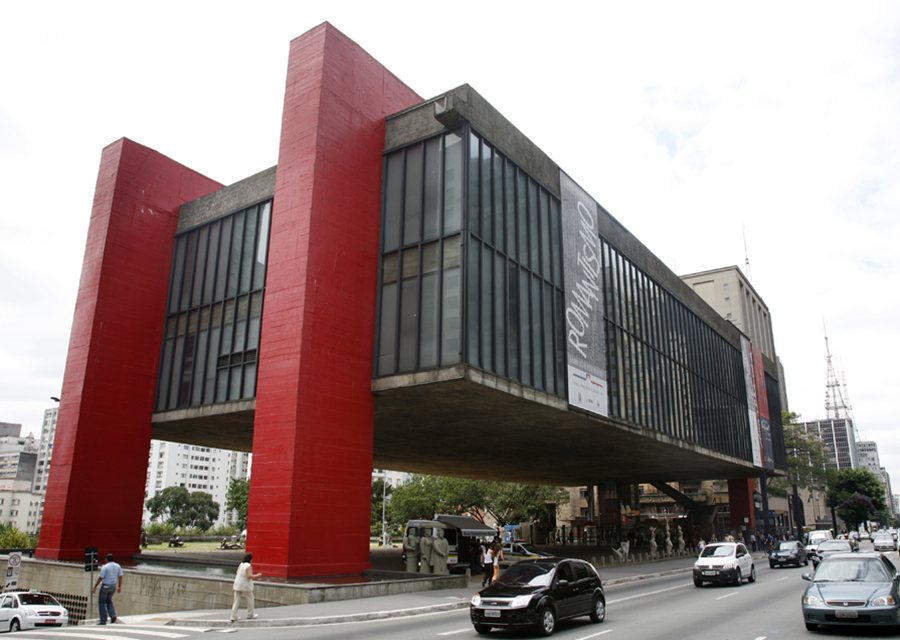
The image size is (900, 640). Identify the location of glass window. (706, 410).